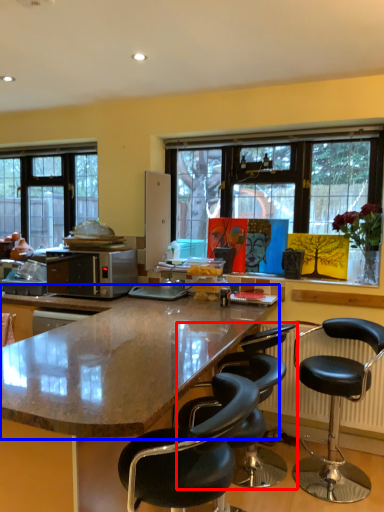
Question: Which object appears farthest to the camera in this image, chair (highlighted by a red box) or countertop (highlighted by a blue box)?

Choices:
 (A) chair
 (B) countertop

Answer: (A)